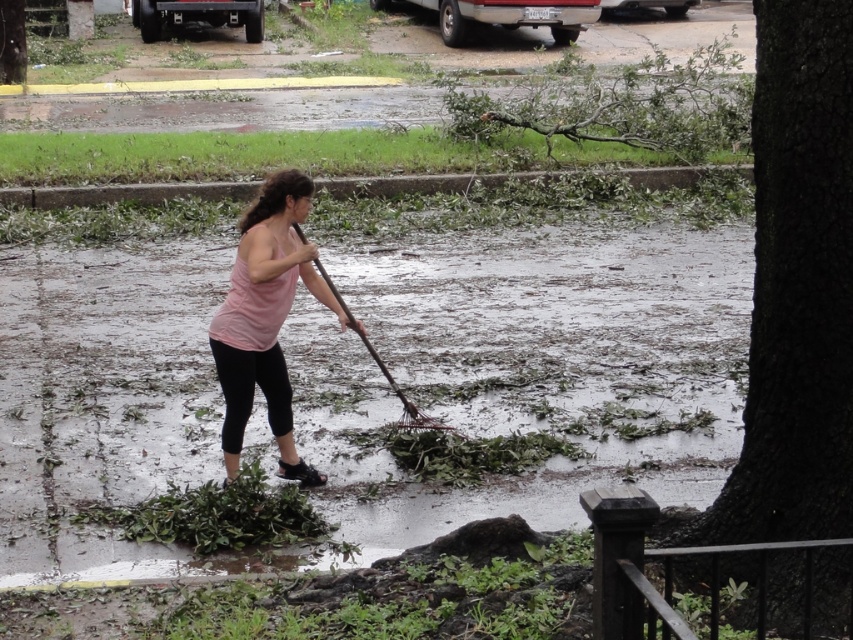
You are a delivery person who needs to deliver a package to the woman in the scene. You see the pink fabric tank top at center and the brown wooden rake at center. Which object is closer to the left side of the scene?

The pink fabric tank top at center is to the left of the brown wooden rake at center, so it is closer to the left side of the scene.

Consider the image. You are a passerby observing the woman cleaning the debris. Which item is positioned lower on her body between the pink fabric tank top at center and the brown wooden rake at center?

The pink fabric tank top at center is located below the brown wooden rake at center, so it is positioned lower on her body.

You are a fashion designer observing a woman in a storm cleanup scene. You notice the pink fabric tank top at center and the brown wooden rake at center. Which clothing item is narrower in width?

The pink fabric tank top at center has a lesser width compared to the brown wooden rake at center, so the pink fabric tank top at center is narrower in width.